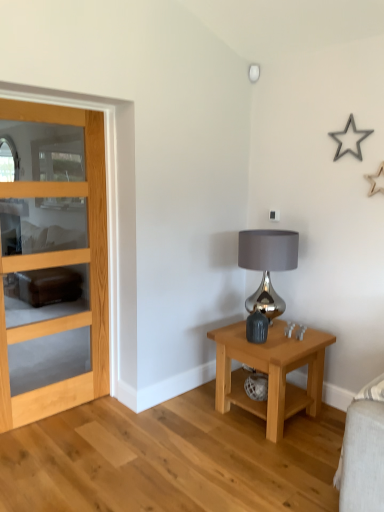
Question: From a real-world perspective, is light wood/finish nightstand at lower right physically located above or below metallic gray lampshade at right?

Choices:
 (A) above
 (B) below

Answer: (B)

Question: Is point (273, 423) positioned closer to the camera than point (248, 311)?

Choices:
 (A) closer
 (B) farther

Answer: (A)

Question: Which is nearer to the satin silver lamp at upper center?

Choices:
 (A) light wood/glass door at left
 (B) light wood/finish nightstand at lower right
 (C) metallic gray lampshade at right

Answer: (C)

Question: Which is farther from the light wood/finish nightstand at lower right?

Choices:
 (A) metallic gray lampshade at right
 (B) light wood/glass door at left
 (C) satin silver lamp at upper center

Answer: (C)